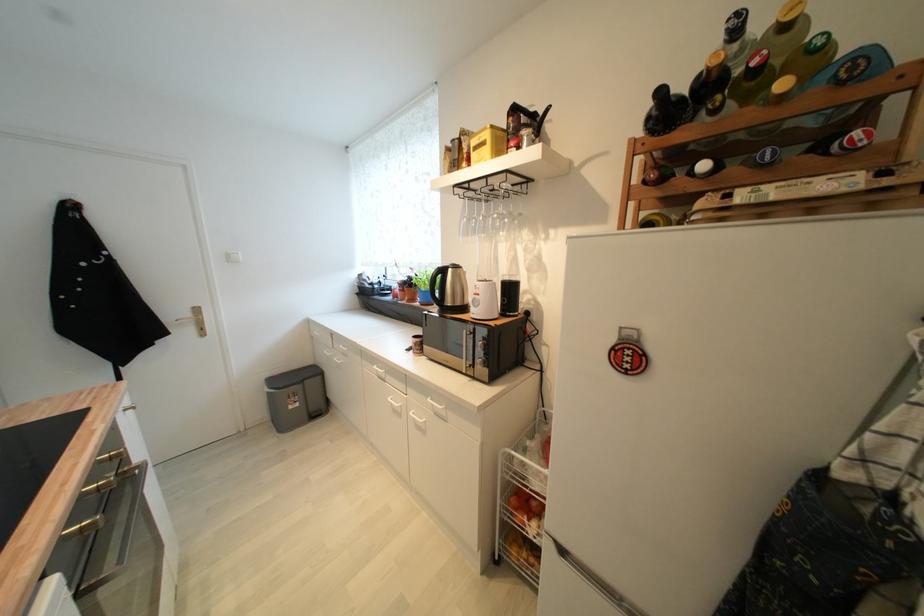
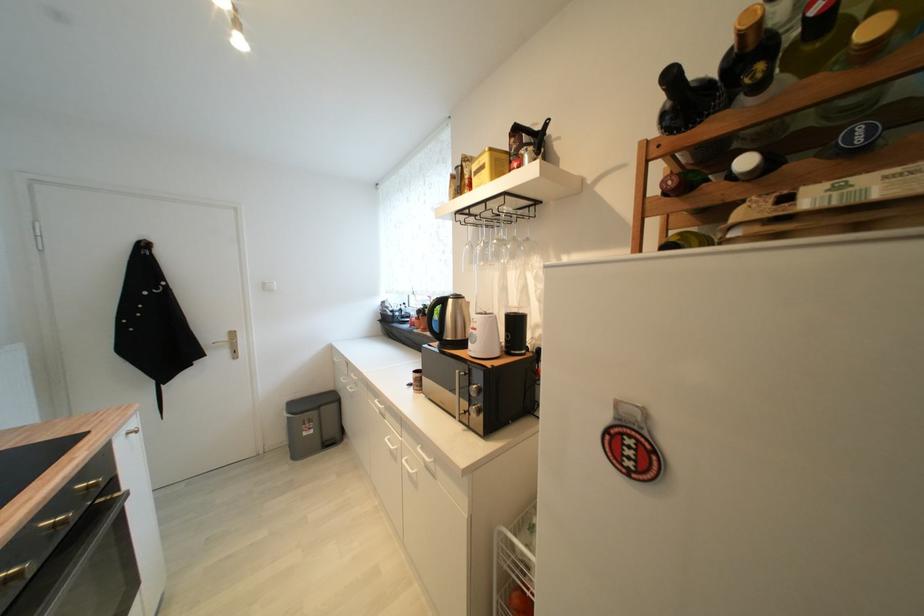
Where in the second image is the point corresponding to point (516, 291) from the first image?

(521, 325)